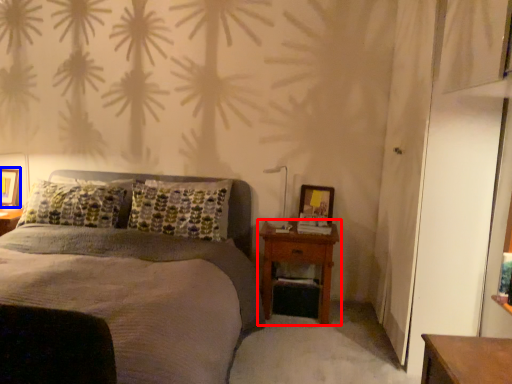
Question: Which point is closer to the camera, nightstand (highlighted by a red box) or picture frame (highlighted by a blue box)?

Choices:
 (A) nightstand
 (B) picture frame

Answer: (A)